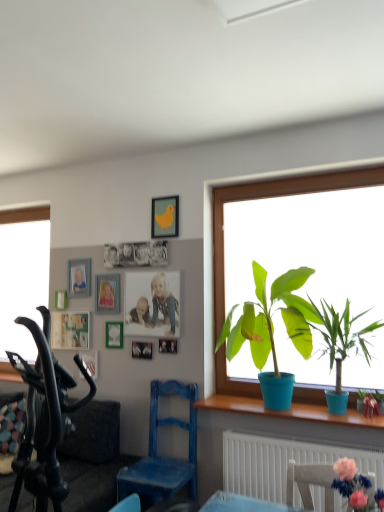
Question: From a real-world perspective, is green matte plant at window, which is counted as the 1th houseplant, starting from the left, positioned under matte yellow bird at upper center, which appears as the seventh picture frame when viewed from the left, based on gravity?

Choices:
 (A) no
 (B) yes

Answer: (B)

Question: Is green matte plant at window, which is counted as the 1th houseplant, starting from the left, thinner than matte yellow bird at upper center, which appears as the second picture frame when viewed from the right?

Choices:
 (A) yes
 (B) no

Answer: (B)

Question: Can you confirm if green matte plant at window, the 3th houseplant in the right-to-left sequence, is wider than matte yellow bird at upper center, which appears as the seventh picture frame when viewed from the left?

Choices:
 (A) no
 (B) yes

Answer: (B)

Question: Is green matte plant at window, which is counted as the 1th houseplant, starting from the left, far away from matte yellow bird at upper center, which appears as the second picture frame when viewed from the right?

Choices:
 (A) yes
 (B) no

Answer: (B)

Question: From the image's perspective, would you say green matte plant at window, the 3th houseplant in the right-to-left sequence, is shown under matte yellow bird at upper center, which appears as the seventh picture frame when viewed from the left?

Choices:
 (A) no
 (B) yes

Answer: (B)

Question: In terms of height, does matte white picture frame at upper left, which appears as the 1th picture frame when viewed from the left, look taller or shorter compared to blue plastic pot at window, placed as the second houseplant when sorted from right to left?

Choices:
 (A) short
 (B) tall

Answer: (A)

Question: Considering the positions of matte white picture frame at upper left, the 8th picture frame viewed from the right, and blue plastic pot at window, placed as the second houseplant when sorted from right to left, in the image, is matte white picture frame at upper left, the 8th picture frame viewed from the right, wider or thinner than blue plastic pot at window, placed as the second houseplant when sorted from right to left,?

Choices:
 (A) thin
 (B) wide

Answer: (A)

Question: In terms of size, does matte white picture frame at upper left, the 8th picture frame viewed from the right, appear bigger or smaller than blue plastic pot at window, placed as the second houseplant when sorted from right to left?

Choices:
 (A) small
 (B) big

Answer: (A)

Question: From the image's perspective, relative to blue plastic pot at window, placed as the second houseplant when sorted from right to left, is matte white picture frame at upper left, the 8th picture frame viewed from the right, above or below?

Choices:
 (A) above
 (B) below

Answer: (A)

Question: From a real-world perspective, is matte wooden picture frame at upper center, arranged as the seventh picture frame when viewed from the right, positioned above or below metallic silver photo frame at upper center, placed as the eighth picture frame when sorted from left to right?

Choices:
 (A) below
 (B) above

Answer: (B)

Question: Considering the positions of matte wooden picture frame at upper center, acting as the second picture frame starting from the left, and metallic silver photo frame at upper center, acting as the first picture frame starting from the right, in the image, is matte wooden picture frame at upper center, acting as the second picture frame starting from the left, wider or thinner than metallic silver photo frame at upper center, acting as the first picture frame starting from the right,?

Choices:
 (A) thin
 (B) wide

Answer: (B)

Question: Looking at the image, does matte wooden picture frame at upper center, acting as the second picture frame starting from the left, seem bigger or smaller compared to metallic silver photo frame at upper center, placed as the eighth picture frame when sorted from left to right?

Choices:
 (A) small
 (B) big

Answer: (B)

Question: Is point (89, 275) positioned closer to the camera than point (162, 351)?

Choices:
 (A) farther
 (B) closer

Answer: (A)

Question: Is blue wooden picture frame at upper center, marked as the third picture frame in a left-to-right arrangement, inside or outside of matte white picture frame at upper left, the 8th picture frame viewed from the right?

Choices:
 (A) outside
 (B) inside

Answer: (A)

Question: Is blue wooden picture frame at upper center, marked as the third picture frame in a left-to-right arrangement, wider or thinner than matte white picture frame at upper left, the 8th picture frame viewed from the right?

Choices:
 (A) thin
 (B) wide

Answer: (A)